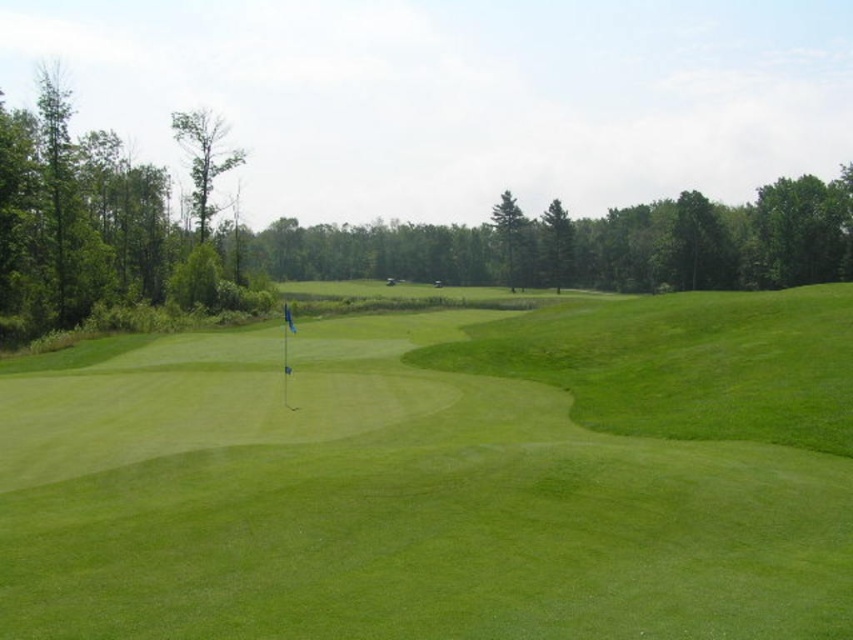
You are standing on the green fairway and want to hit a golf ball to the point marked at coordinates point (16, 284). Your golf club can hit the ball up to 60 meters. Will you be able to reach the point with your current club?

The distance to point (16, 284) is 65.10 meters, which is beyond the 60 meters your club can hit. You will not be able to reach the point with your current club.

You are a golfer standing on the fairway and see the green leafy tree at left and the smooth brown tree at upper left. Which tree is closer to you?

The green leafy tree at left is closer to you as it is positioned in front of the smooth brown tree at upper left.

You are a golfer standing at the tee box and want to hit the ball towards the hole marked by the blue flag on the left side of the fairway. There is a smooth brown tree at upper left in your line of sight. Based on its position, will the tree block your direct path to the hole?

The smooth brown tree at upper left is located at point [202,157], which is positioned to the upper left area of the image. Since the blue flag is on the left side of the fairway, the tree might be blocking your direct path depending on the exact alignment. However, without specific distance details, it is uncertain. But according to the given information, the tree is at upper left coordinates, so it could potentially obstruct the line of sight to the hole marked by the blue flag on the left side.